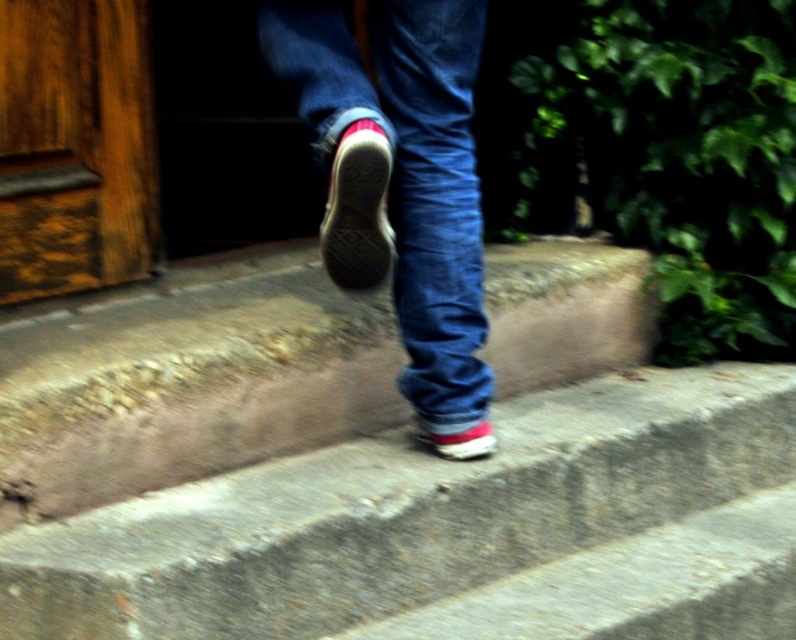
Question: Is denim at center closer to the viewer compared to shiny red sneaker at lower center?

Choices:
 (A) no
 (B) yes

Answer: (B)

Question: Is shiny leather sneaker at center below shiny red sneaker at lower center?

Choices:
 (A) yes
 (B) no

Answer: (B)

Question: Which point is farther to the camera?

Choices:
 (A) wooden door at upper left
 (B) denim at center
 (C) shiny red sneaker at lower center

Answer: (A)

Question: Considering the real-world distances, which object is closest to the wooden door at upper left?

Choices:
 (A) shiny red sneaker at lower center
 (B) shiny leather sneaker at center
 (C) denim at center

Answer: (C)

Question: Is shiny leather sneaker at center behind shiny red sneaker at lower center?

Choices:
 (A) no
 (B) yes

Answer: (A)

Question: Which is farther from the denim at center?

Choices:
 (A) wooden door at upper left
 (B) shiny red sneaker at lower center
 (C) shiny leather sneaker at center

Answer: (A)